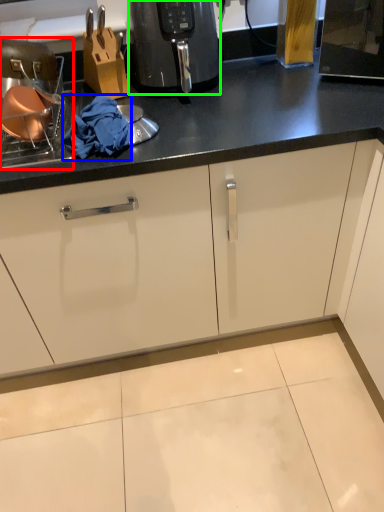
Question: Which object is positioned farthest from appliance (highlighted by a red box)? Select from material (highlighted by a blue box) and home appliance (highlighted by a green box).

Choices:
 (A) material
 (B) home appliance

Answer: (B)